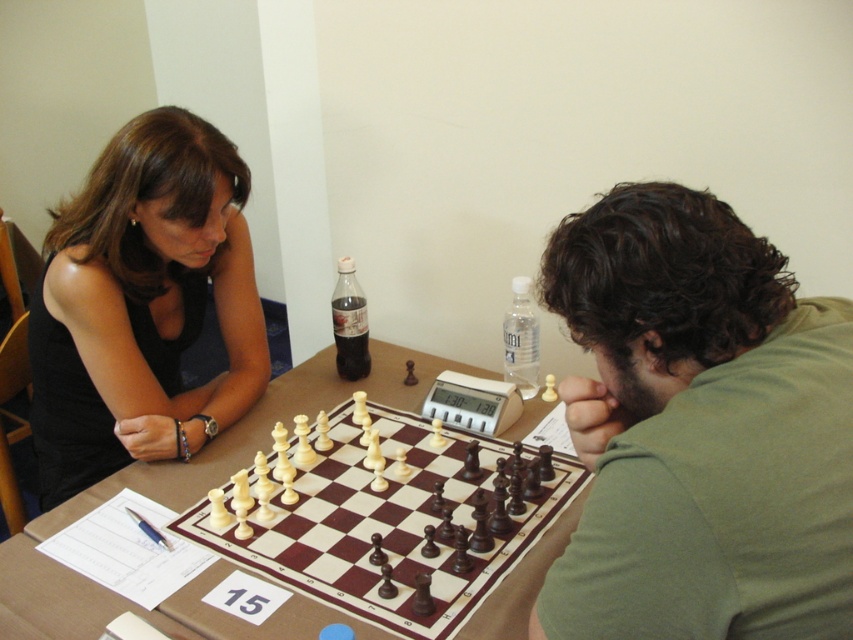
Based on the scene description, which object is smaller in size between the green matte shirt at center and the black fabric shirt at upper left?

The green matte shirt at center is smaller than the black fabric shirt at upper left.

You are standing behind the chessboard and want to reach both the black fabric shirt at upper left and the brown wooden table at center. Which object is closer to you?

The brown wooden table at center is closer to you because it is positioned centrally on the table, while the black fabric shirt at upper left is to the left of it, placing it further away.

You are a photographer standing behind the chessboard. You want to take a photo of the black fabric shirt at upper left and the dark glass bottle at center. Which object will appear larger in the photo?

The black fabric shirt at upper left is closer to the viewer than the dark glass bottle at center, so it will appear larger in the photo.